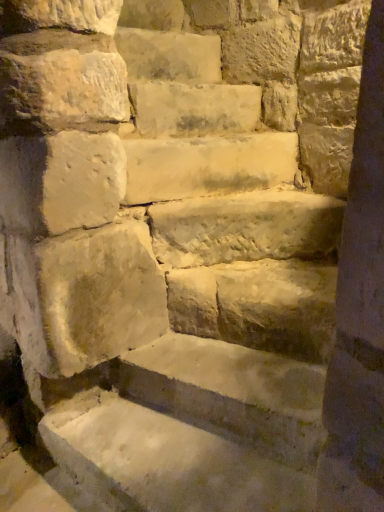
Question: Would you say smooth beige stone at center is inside or outside smooth beige stone steps at center?

Choices:
 (A) inside
 (B) outside

Answer: (B)

Question: Considering the positions of smooth beige stone at center and smooth beige stone steps at center in the image, is smooth beige stone at center wider or thinner than smooth beige stone steps at center?

Choices:
 (A) wide
 (B) thin

Answer: (B)

Question: Which object is the farthest from the light beige stone at center, which is the first brick in bottom-to-top order?

Choices:
 (A) smooth beige stone at center
 (B) smooth beige stone steps at center
 (C) light beige stone at upper center, the second brick in the bottom-to-top sequence

Answer: (B)

Question: Which object is positioned closest to the smooth beige stone steps at center?

Choices:
 (A) light beige stone at center, which is the first brick in bottom-to-top order
 (B) light beige stone at upper center, the second brick in the bottom-to-top sequence
 (C) smooth beige stone at center

Answer: (C)